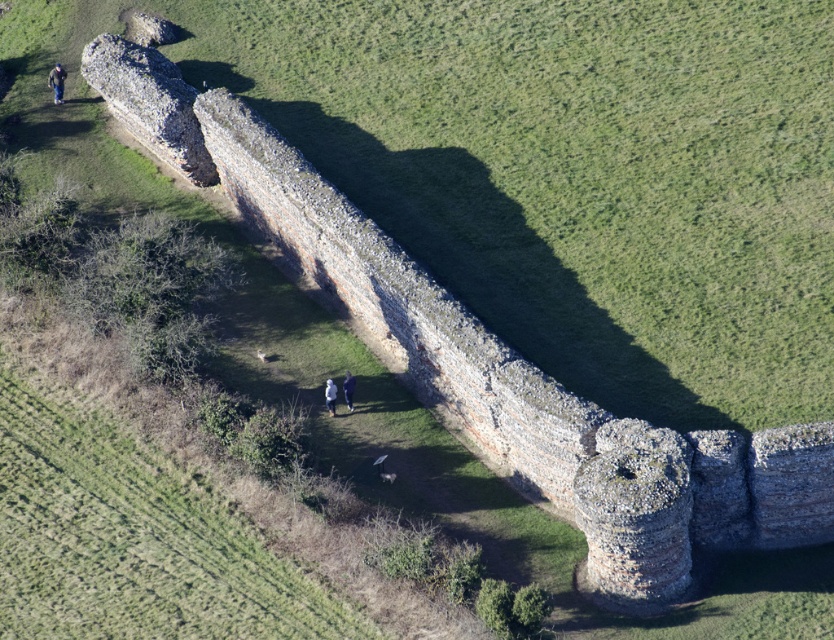
You are a photographer standing at the base of the historical stone wall. You notice two items in the scene described in the image. One is the dark blue jeans at upper left and the other is the blue fabric jacket at center. From your vantage point, which item appears higher up in the image?

The dark blue jeans at upper left appears higher up in the image than the blue fabric jacket at center because it is located above it according to the description.

You are a photographer trying to capture both the white fabric jacket at center and the blue fabric jacket at center in a single shot. Given that your camera has a minimum focus distance of 30 centimeters, will you be able to focus on both jackets simultaneously?

The white fabric jacket at center and blue fabric jacket at center are 31.36 centimeters apart from each other. Since the distance between them is greater than the camera minimum focus distance of 30 centimeters, the camera can focus on both jackets simultaneously.

You are a drone operator flying a drone that can only fly up to 70 meters away from its starting position. You need to fly the drone to the point labeled as point [59,92]. Can you safely reach that point without exceeding the drone maximum distance limit?

The distance of point [59,92] from camera is 69.13 meters, so yes, the drone can safely reach that point since it is within the 70 meters maximum distance limit.